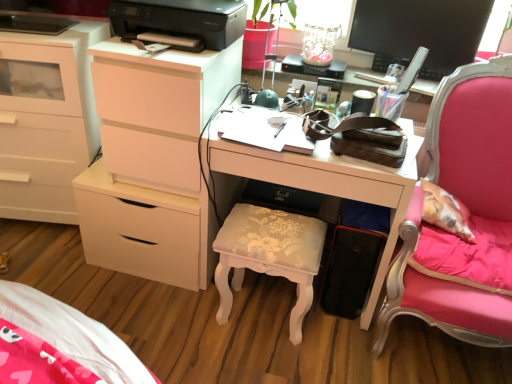
The width and height of the screenshot is (512, 384). I want to click on blank space situated above white floral-patterned stool at center (from a real-world perspective), so pyautogui.click(x=273, y=228).